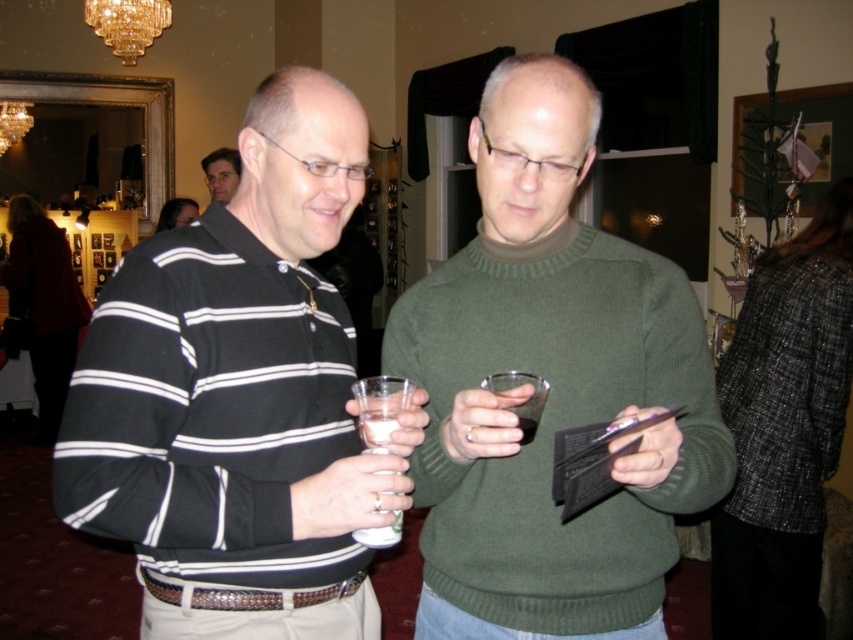
Does green wool sweater at center have a lesser width compared to crystal glass chandelier at upper center?

Incorrect, green wool sweater at center's width is not less than crystal glass chandelier at upper center's.

Is green wool sweater at center closer to the viewer compared to crystal glass chandelier at upper center?

Yes, green wool sweater at center is in front of crystal glass chandelier at upper center.

Find the location of a particular element. Image resolution: width=853 pixels, height=640 pixels. green wool sweater at center is located at coordinates (550, 388).

Between clear plastic cup at center and transparent glass at center, which one appears on the left side from the viewer's perspective?

clear plastic cup at center

Is clear plastic cup at center positioned in front of transparent glass at center?

No, clear plastic cup at center is behind transparent glass at center.

The height and width of the screenshot is (640, 853). What do you see at coordinates (380, 408) in the screenshot?
I see `clear plastic cup at center` at bounding box center [380, 408].

Where is `clear plastic cup at center`? This screenshot has height=640, width=853. clear plastic cup at center is located at coordinates (380, 408).

Does black striped sweater at left appear on the right side of clear plastic cup at center?

No, black striped sweater at left is not to the right of clear plastic cup at center.

Does black striped sweater at left have a greater width compared to clear plastic cup at center?

Yes, black striped sweater at left is wider than clear plastic cup at center.

Is point (68, 522) closer to camera compared to point (369, 390)?

Yes, point (68, 522) is in front of point (369, 390).

The height and width of the screenshot is (640, 853). I want to click on black striped sweater at left, so click(239, 397).